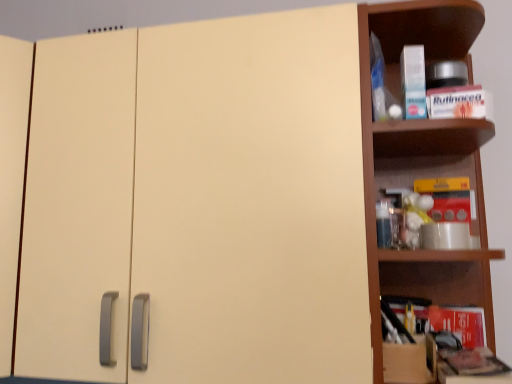
Question: Is brown wooden shelf at right positioned beyond the bounds of matte cream cabinet at center?

Choices:
 (A) yes
 (B) no

Answer: (A)

Question: Is the depth of brown wooden shelf at right greater than that of matte cream cabinet at center?

Choices:
 (A) no
 (B) yes

Answer: (B)

Question: Does brown wooden shelf at right have a greater width compared to matte cream cabinet at center?

Choices:
 (A) no
 (B) yes

Answer: (A)

Question: From the image's perspective, does brown wooden shelf at right appear higher than matte cream cabinet at center?

Choices:
 (A) yes
 (B) no

Answer: (A)

Question: From a real-world perspective, is brown wooden shelf at right physically above matte cream cabinet at center?

Choices:
 (A) yes
 (B) no

Answer: (A)

Question: Is brown wooden shelf at right at the left side of matte cream cabinet at center?

Choices:
 (A) yes
 (B) no

Answer: (B)

Question: Considering the relative sizes of brown wooden shelf at right and cardboard box at right in the image provided, is brown wooden shelf at right smaller than cardboard box at right?

Choices:
 (A) no
 (B) yes

Answer: (A)

Question: From a real-world perspective, does brown wooden shelf at right sit lower than cardboard box at right?

Choices:
 (A) yes
 (B) no

Answer: (B)

Question: Considering the relative sizes of brown wooden shelf at right and cardboard box at right in the image provided, is brown wooden shelf at right wider than cardboard box at right?

Choices:
 (A) no
 (B) yes

Answer: (B)

Question: Is brown wooden shelf at right closer to the viewer compared to cardboard box at right?

Choices:
 (A) yes
 (B) no

Answer: (A)

Question: Is brown wooden shelf at right far from cardboard box at right?

Choices:
 (A) no
 (B) yes

Answer: (A)

Question: Is brown wooden shelf at right thinner than cardboard box at right?

Choices:
 (A) yes
 (B) no

Answer: (B)

Question: Is the depth of cardboard box at right less than that of brown wooden shelf at right?

Choices:
 (A) no
 (B) yes

Answer: (A)